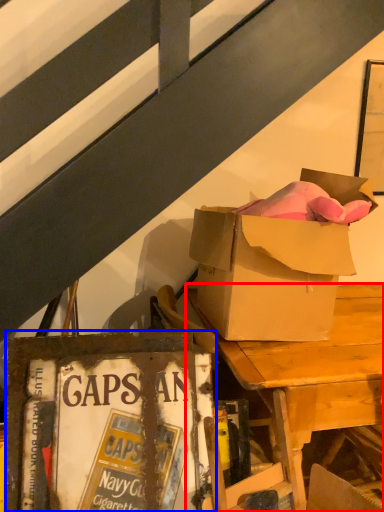
Question: Which of the following is the closest to the observer, desk (highlighted by a red box) or paperback book (highlighted by a blue box)?

Choices:
 (A) desk
 (B) paperback book

Answer: (B)